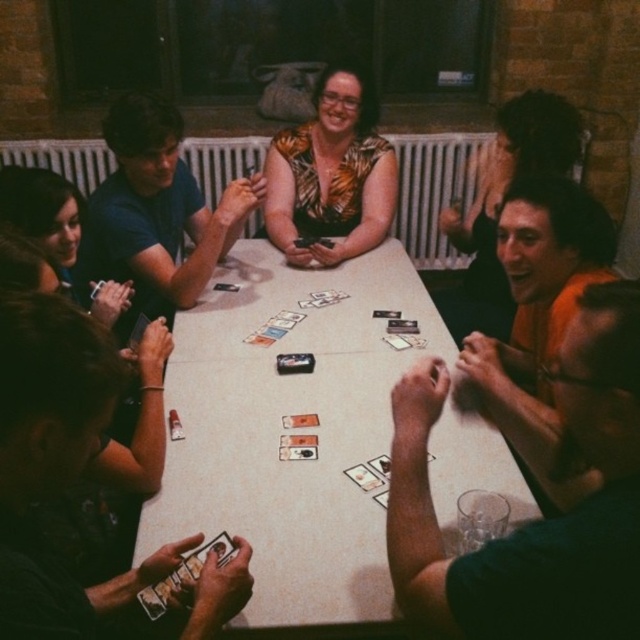
Question: Is white glossy table at center positioned behind printed fabric blouse at center?

Choices:
 (A) no
 (B) yes

Answer: (A)

Question: Which object appears closest to the camera in this image?

Choices:
 (A) white glossy table at center
 (B) printed fabric blouse at center

Answer: (A)

Question: Is white glossy table at center smaller than printed fabric blouse at center?

Choices:
 (A) no
 (B) yes

Answer: (A)

Question: Can you confirm if white glossy table at center is positioned to the left of printed fabric blouse at center?

Choices:
 (A) no
 (B) yes

Answer: (B)